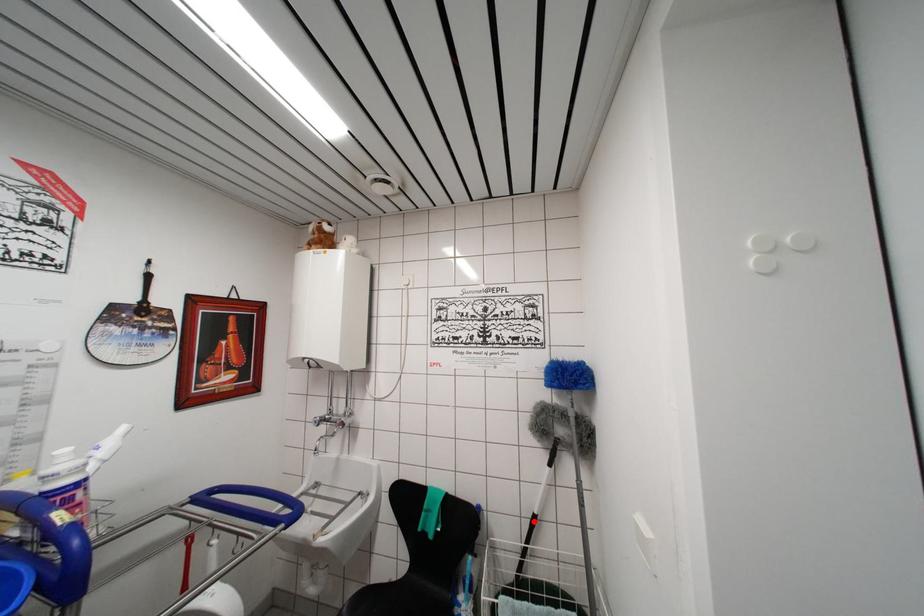
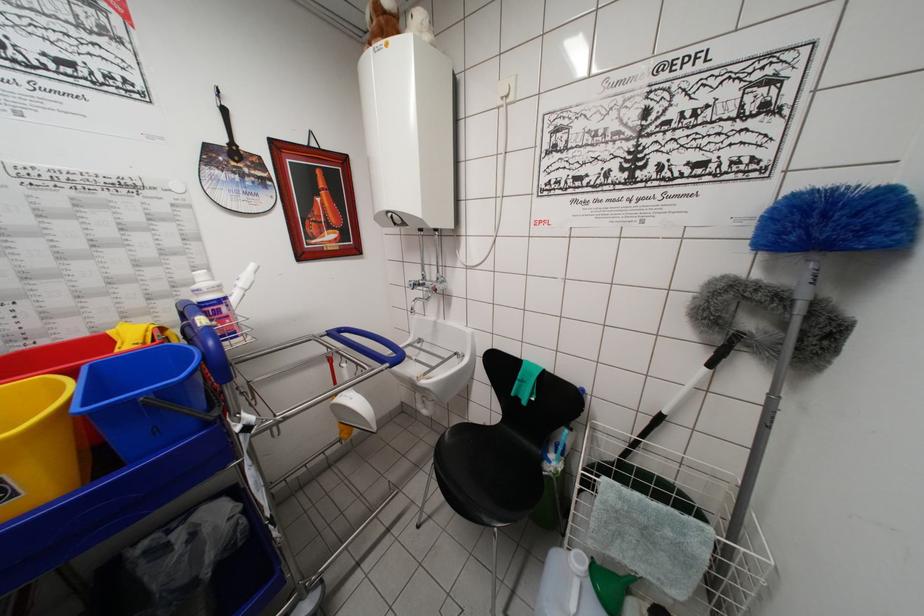
Find the pixel in the second image that matches the highlighted location in the first image.

(658, 419)